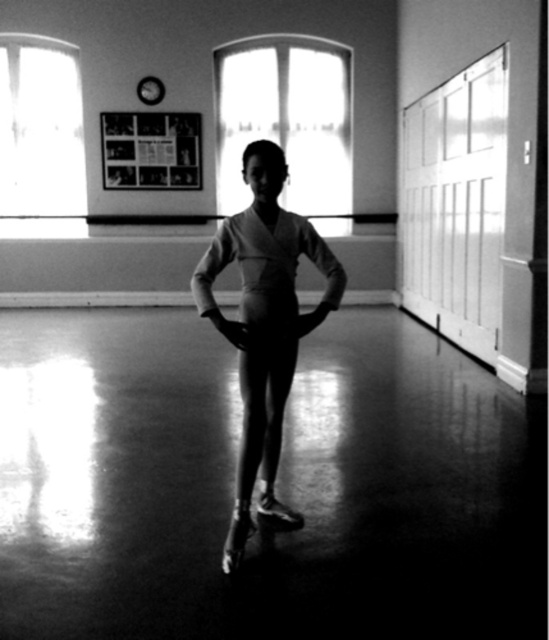
You are a costume designer preparing for a dance performance. You have two items at the center of your design board, the matte white leotard at center and the smooth fabric tights at center. Which one should you choose if you want the main costume piece to be larger in size?

The matte white leotard at center is bigger than the smooth fabric tights at center, so you should choose the matte white leotard at center as the main costume piece since it is larger in size.